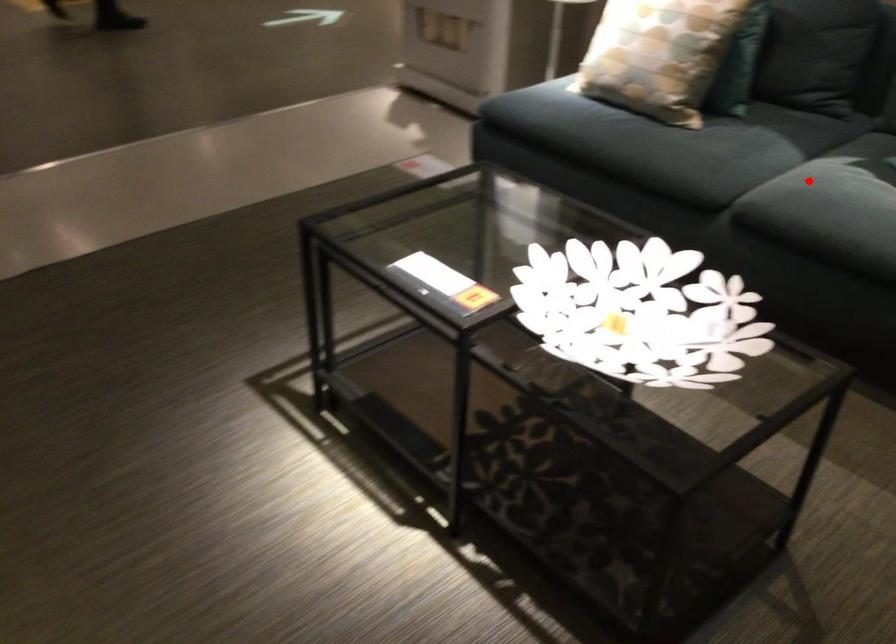
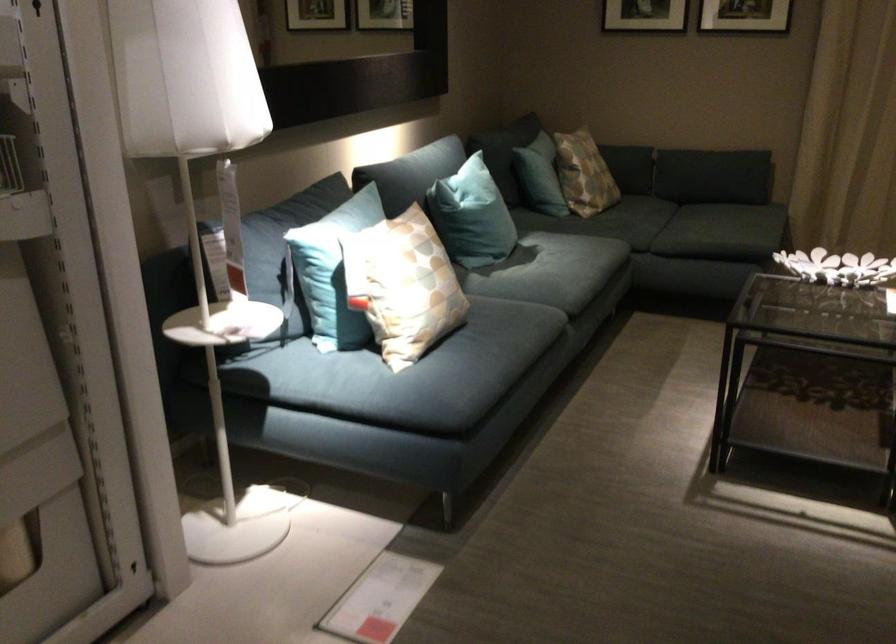
Question: I am providing you with two images of the same scene from different viewpoints. Image1 has a red point marked. In image2, the corresponding 3D location appears at what relative position? Reply with the corresponding letter.

Choices:
 (A) Closer
 (B) Farther

Answer: (B)